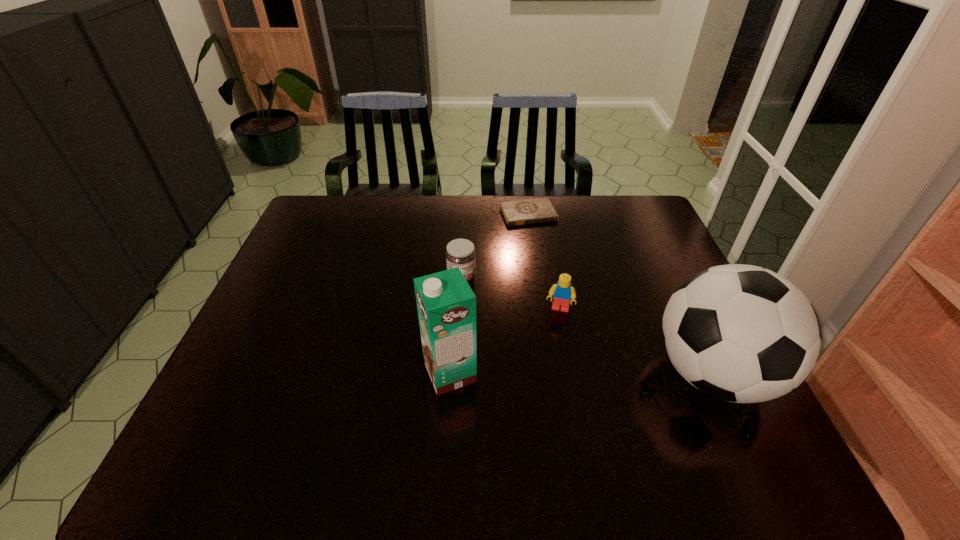
I want to click on free space on the desktop that is between the carton and the soccer ball and is positioned on the front-facing side of the Lego, so click(x=549, y=373).

Where is `free spot on the desktop that is between the carton and the soccer ball and is positioned on the front label of the second farthest object`? The image size is (960, 540). free spot on the desktop that is between the carton and the soccer ball and is positioned on the front label of the second farthest object is located at coordinates (596, 373).

Locate an element on the screen. This screenshot has width=960, height=540. free space on the desktop that is between the carton and the rightmost object and is positioned on the spine side of the shortest object is located at coordinates (606, 373).